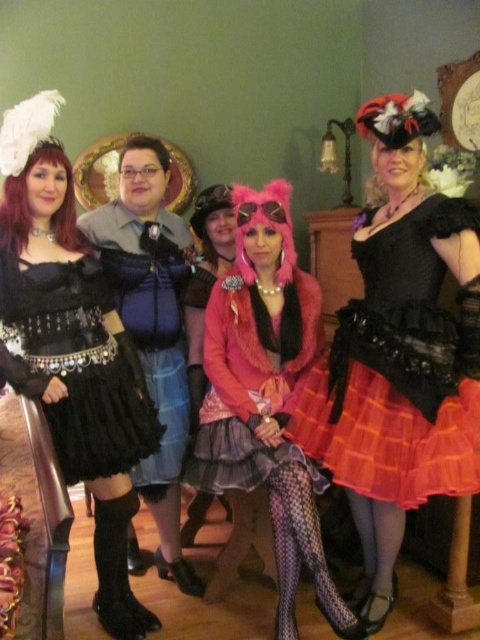
You are a photographer at the event and need to adjust the lighting so that the black satin dress at left is fully visible without being blocked by the orange plaid skirt at center. What should you do?

The black satin dress at left is currently behind the orange plaid skirt at center. To make it fully visible, you should move the orange plaid skirt at center to the side or adjust the positioning of the black satin dress at left so it is no longer obstructed.